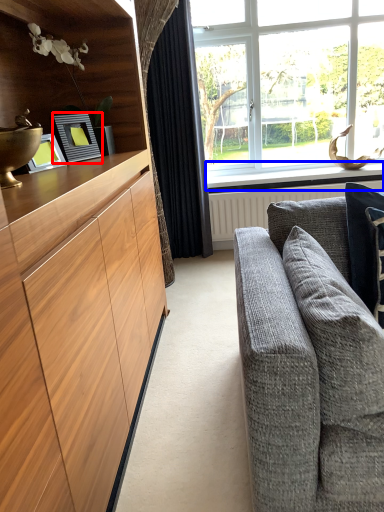
Question: Which object appears farthest to the camera in this image, picture frame (highlighted by a red box) or window sill (highlighted by a blue box)?

Choices:
 (A) picture frame
 (B) window sill

Answer: (B)